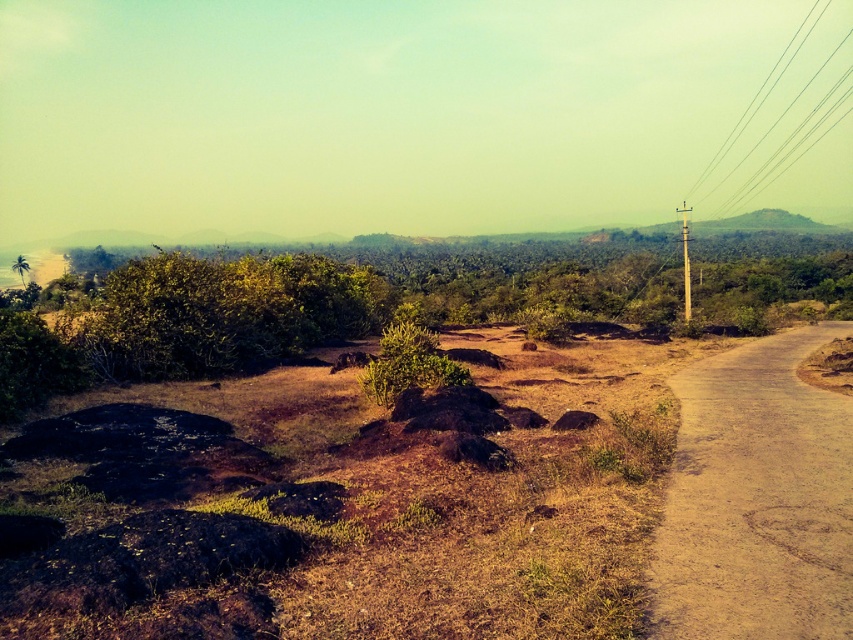
Based on the photo, you are a bird flying over the rural landscape. You see the metallic wire at right and the green leafy tree at left. Which object would appear bigger from your perspective?

The metallic wire at right appears bigger than the green leafy tree at left from the bird perspective.

You are a bird flying over the rural landscape. You see the metallic wire at right and the green leafy tree at left. Which object is higher from the ground?

The metallic wire at right is above the green leafy tree at left, so the metallic wire at right is higher from the ground.

You are a delivery drone with a wingspan of 1.5 meters. You need to fly from the dirt road at right to the metallic wire at right. Is there enough space between them for you to pass through?

The distance between the dirt road at right and the metallic wire at right is 238.88 meters, so yes, the drone can pass through since the space is much larger than its wingspan.